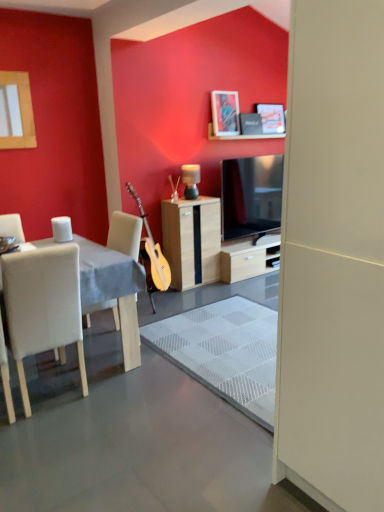
Where is `free point above matte black picture frame at upper center, which ranks as the second picture frame in left-to-right order (from a real-world perspective)`? free point above matte black picture frame at upper center, which ranks as the second picture frame in left-to-right order (from a real-world perspective) is located at coordinates (261, 104).